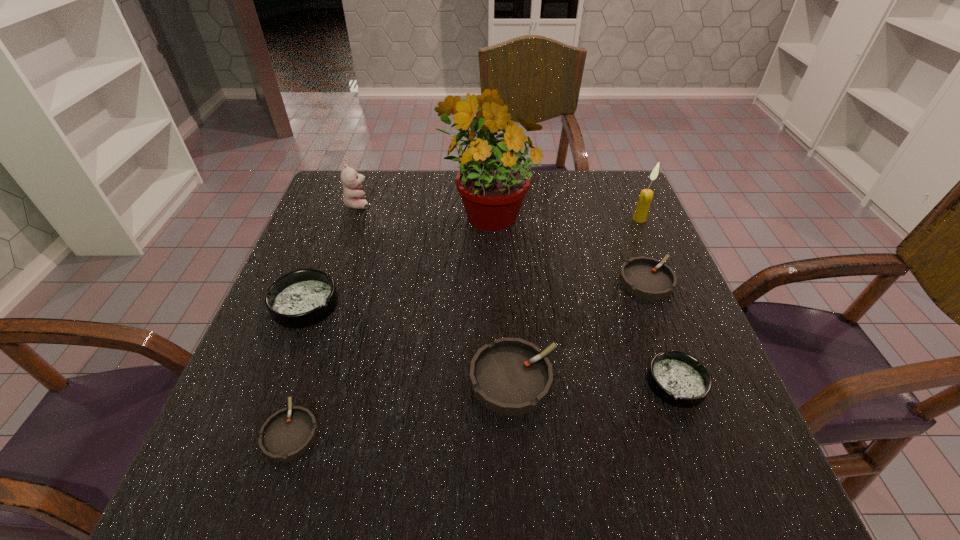
In order to click on free space between the seventh shortest object and the bigger dark ashtray in this screenshot , I will do `click(472, 261)`.

At what (x,y) coordinates should I click in order to perform the action: click on empty location between the bigger dark ashtray and the pink teddy bear. Please return your answer as a coordinate pair (x, y). Image resolution: width=960 pixels, height=540 pixels. Looking at the image, I should click on (331, 254).

Identify the location of unoccupied position between the tallest object and the right dark ashtray. The height and width of the screenshot is (540, 960). (582, 297).

Where is `unoccupied area between the smaller dark ashtray and the third tallest object`? The image size is (960, 540). unoccupied area between the smaller dark ashtray and the third tallest object is located at coordinates (517, 293).

This screenshot has width=960, height=540. In order to click on vacant space that's between the right dark ashtray and the flowerpot in this screenshot , I will do `click(582, 297)`.

The height and width of the screenshot is (540, 960). Identify the location of unoccupied position between the seventh shortest object and the smallest gray ashtray. (466, 325).

Select which object is the sixth closest to the shortest object. Please provide its 2D coordinates. Your answer should be formatted as a tuple, i.e. [(x, y)], where the tuple contains the x and y coordinates of a point satisfying the conditions above.

[(647, 278)]

Locate which object ranks in proximity to the biggest gray ashtray. Please provide its 2D coordinates. Your answer should be formatted as a tuple, i.e. [(x, y)], where the tuple contains the x and y coordinates of a point satisfying the conditions above.

[(677, 378)]

At what (x,y) coordinates should I click in order to perform the action: click on the second closest ashtray relative to the teddy bear. Please return your answer as a coordinate pair (x, y). This screenshot has width=960, height=540. Looking at the image, I should click on pos(510,376).

This screenshot has width=960, height=540. What are the coordinates of `ashtray that is the fourth closest to the nearer dark ashtray` in the screenshot? It's located at (301, 298).